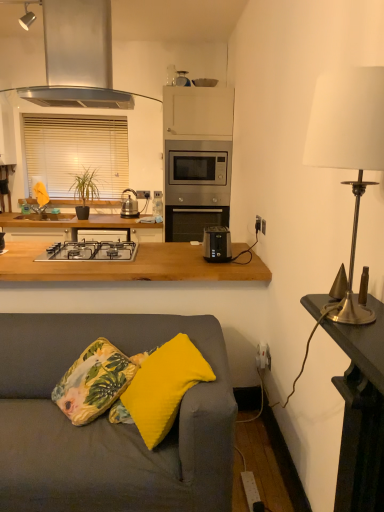
Question: Are polished brass table lamp at right and green matte plant at left located far from each other?

Choices:
 (A) yes
 (B) no

Answer: (A)

Question: From a real-world perspective, is polished brass table lamp at right located higher than green matte plant at left?

Choices:
 (A) yes
 (B) no

Answer: (A)

Question: From a real-world perspective, does polished brass table lamp at right sit lower than green matte plant at left?

Choices:
 (A) yes
 (B) no

Answer: (B)

Question: Does polished brass table lamp at right have a greater height compared to green matte plant at left?

Choices:
 (A) yes
 (B) no

Answer: (A)

Question: Is polished brass table lamp at right wider than green matte plant at left?

Choices:
 (A) yes
 (B) no

Answer: (B)

Question: Does polished brass table lamp at right have a lesser width compared to green matte plant at left?

Choices:
 (A) no
 (B) yes

Answer: (B)

Question: From a real-world perspective, is gold metallic lamp at right, the 3th appliance from the top, on top of satin silver microwave at upper center, the 2th appliance when ordered from right to left?

Choices:
 (A) no
 (B) yes

Answer: (A)

Question: Does gold metallic lamp at right, the 3th appliance from the back, have a lesser height compared to satin silver microwave at upper center, placed as the 2th appliance when sorted from front to back?

Choices:
 (A) yes
 (B) no

Answer: (A)

Question: From the image's perspective, is gold metallic lamp at right, positioned as the 1th appliance in right-to-left order, above satin silver microwave at upper center, positioned as the first appliance in top-to-bottom order?

Choices:
 (A) yes
 (B) no

Answer: (B)

Question: Considering the relative positions of gold metallic lamp at right, the 3th appliance from the back, and satin silver microwave at upper center, the 2th appliance when ordered from right to left, in the image provided, is gold metallic lamp at right, the 3th appliance from the back, to the right of satin silver microwave at upper center, the 2th appliance when ordered from right to left, from the viewer's perspective?

Choices:
 (A) no
 (B) yes

Answer: (B)

Question: Can you confirm if gold metallic lamp at right, the 3th appliance from the top, is positioned to the left of satin silver microwave at upper center, the 2th appliance viewed from the back?

Choices:
 (A) yes
 (B) no

Answer: (B)

Question: Would you say satin silver microwave at upper center, which is the 2th appliance in left-to-right order, is part of gold metallic lamp at right, the 3th appliance when ordered from left to right,'s contents?

Choices:
 (A) yes
 (B) no

Answer: (B)

Question: Can you confirm if satin silver microwave at upper center, the 2th appliance when ordered from right to left, is shorter than yellow fabric pillow at lower center, which is counted as the first pillow, starting from the back?

Choices:
 (A) yes
 (B) no

Answer: (A)